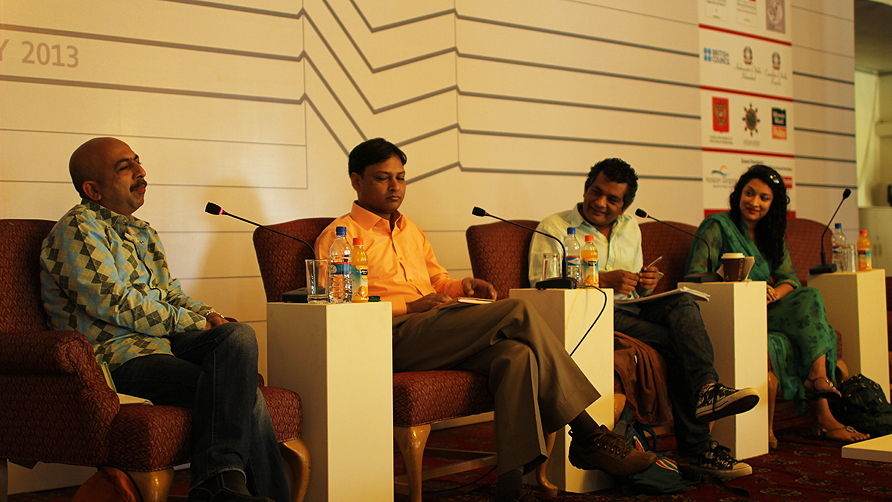
This screenshot has height=502, width=892. In order to click on 1 glass cup 9n this table in this screenshot , I will do `click(323, 272)`.